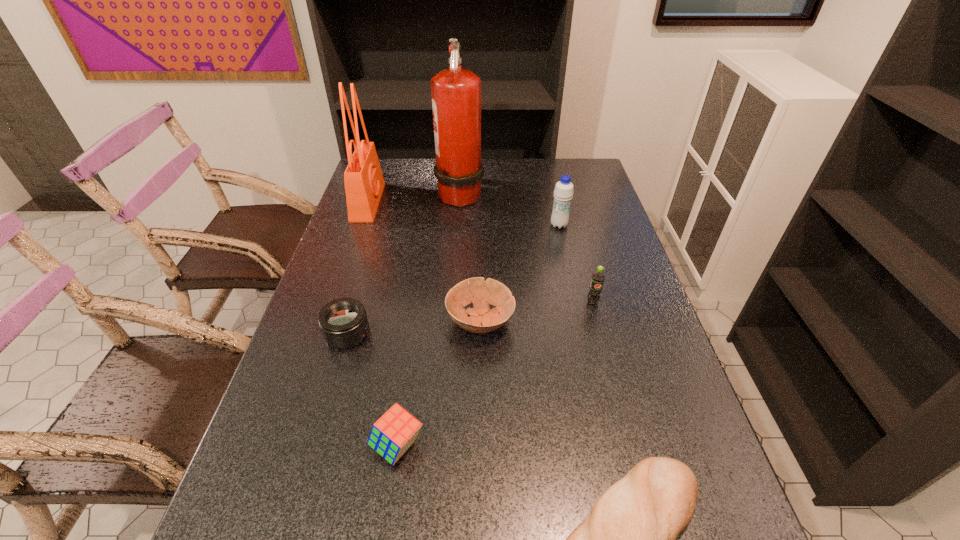
What are the coordinates of `object at the far left corner` in the screenshot? It's located at 364,183.

Find the location of `free space at the far edge of the desktop`. free space at the far edge of the desktop is located at coordinates (551, 183).

You are a GUI agent. You are given a task and a screenshot of the screen. Output one action in this format:
    pyautogui.click(x=<x>, y=<y>)
    Task: Click on the vacant area at the left edge
    
    Given the screenshot: What is the action you would take?
    pyautogui.click(x=345, y=362)

In order to click on vacant space at the right edge of the desktop in this screenshot , I will do `click(604, 256)`.

Locate an element on the screen. The width and height of the screenshot is (960, 540). empty space that is in between the water bottle and the telephoto lens is located at coordinates pos(453,279).

Locate an element on the screen. The width and height of the screenshot is (960, 540). vacant area that lies between the bowl and the soda is located at coordinates (537, 312).

Where is `unoccupied position between the telephoto lens and the water bottle`? This screenshot has width=960, height=540. unoccupied position between the telephoto lens and the water bottle is located at coordinates [453, 279].

Identify the location of free space between the soda and the bowl. Image resolution: width=960 pixels, height=540 pixels. (537, 312).

You are a GUI agent. You are given a task and a screenshot of the screen. Output one action in this format:
    pyautogui.click(x=<x>, y=<y>)
    Task: Click on the vacant space that's between the fire extinguisher and the bowl
    
    Given the screenshot: What is the action you would take?
    pyautogui.click(x=470, y=257)

Locate which object ranks fourth in proximity to the bowl. Please provide its 2D coordinates. Your answer should be formatted as a tuple, i.e. [(x, y)], where the tuple contains the x and y coordinates of a point satisfying the conditions above.

[(628, 539)]